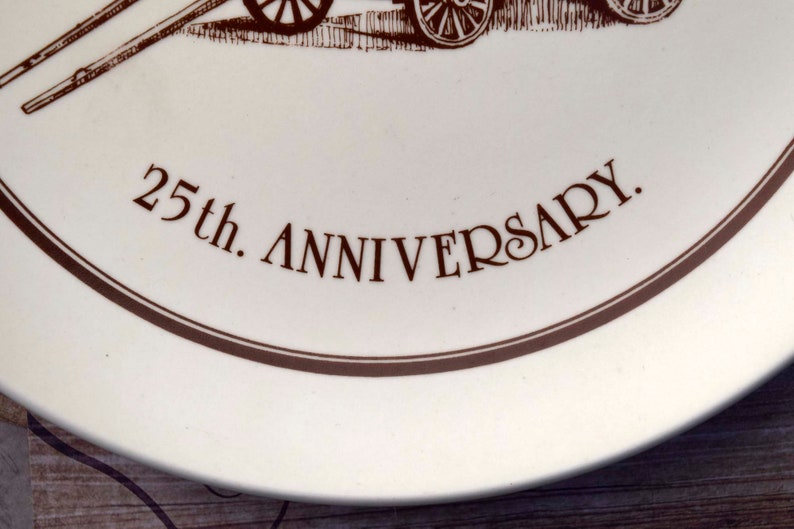
Find the location of `pattern on wooden surface`. pattern on wooden surface is located at coordinates (66, 449), (278, 518), (220, 496).